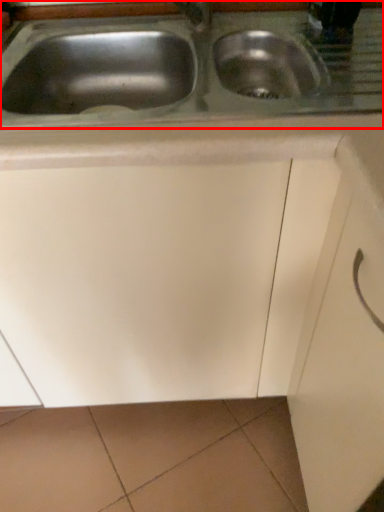
Question: From the image, what is the correct spatial relationship of sink (annotated by the red box) in relation to drawer?

Choices:
 (A) right
 (B) left

Answer: (B)